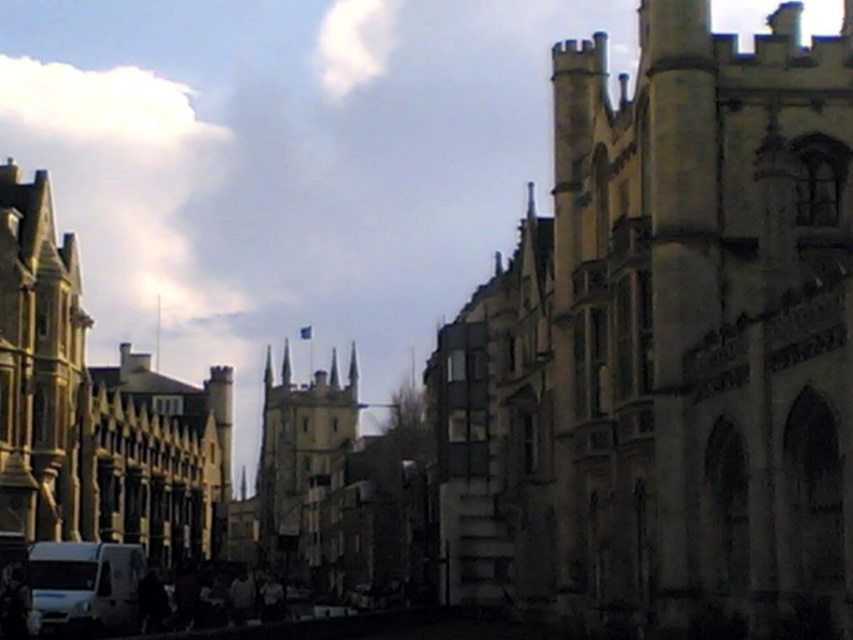
Question: Does stone spire at center come behind white matte van at lower left?

Choices:
 (A) no
 (B) yes

Answer: (B)

Question: Which object appears closest to the camera in this image?

Choices:
 (A) stone spire at center
 (B) white matte van at lower left

Answer: (B)

Question: Does stone spire at center have a larger size compared to white matte van at lower left?

Choices:
 (A) no
 (B) yes

Answer: (B)

Question: Among these objects, which one is farthest from the camera?

Choices:
 (A) white matte van at lower left
 (B) stone spire at center

Answer: (B)

Question: Does stone spire at center appear on the left side of white matte van at lower left?

Choices:
 (A) yes
 (B) no

Answer: (A)